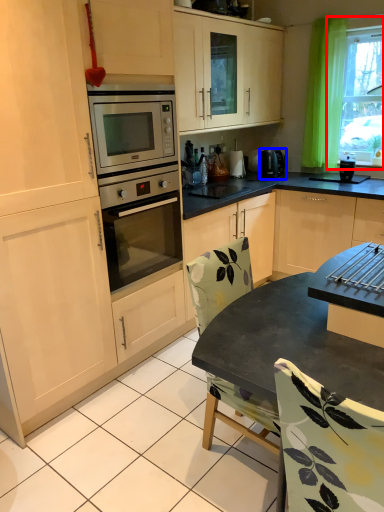
Question: Which of the following is the closest to the observer, window (highlighted by a red box) or kitchen appliance (highlighted by a blue box)?

Choices:
 (A) window
 (B) kitchen appliance

Answer: (A)